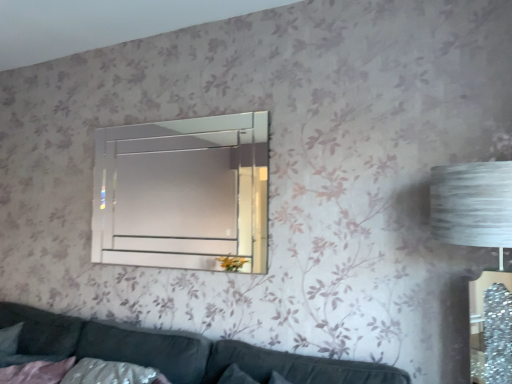
Question: Relative to clear glass mirror at upper center, is velvet dark grey couch at lower center in front or behind?

Choices:
 (A) front
 (B) behind

Answer: (A)

Question: From the image's perspective, is velvet dark grey couch at lower center located above or below clear glass mirror at upper center?

Choices:
 (A) below
 (B) above

Answer: (A)

Question: Is velvet dark grey couch at lower center bigger or smaller than clear glass mirror at upper center?

Choices:
 (A) big
 (B) small

Answer: (A)

Question: From the image's perspective, is clear glass mirror at upper center positioned above or below velvet dark grey couch at lower center?

Choices:
 (A) below
 (B) above

Answer: (B)

Question: Do you think clear glass mirror at upper center is within velvet dark grey couch at lower center, or outside of it?

Choices:
 (A) outside
 (B) inside

Answer: (A)

Question: Is clear glass mirror at upper center in front of or behind velvet dark grey couch at lower center in the image?

Choices:
 (A) behind
 (B) front

Answer: (A)

Question: In the image, is clear glass mirror at upper center on the left side or the right side of velvet dark grey couch at lower center?

Choices:
 (A) left
 (B) right

Answer: (A)